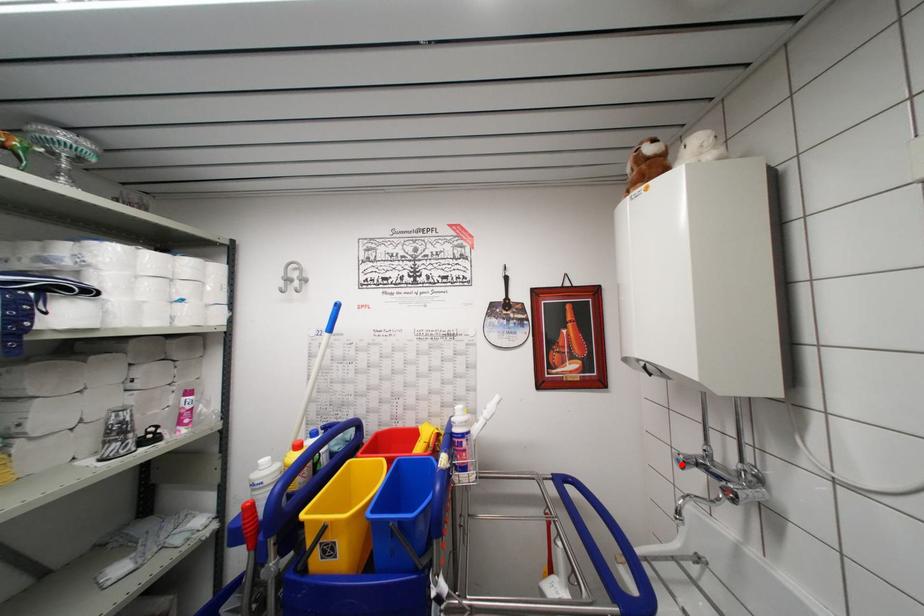
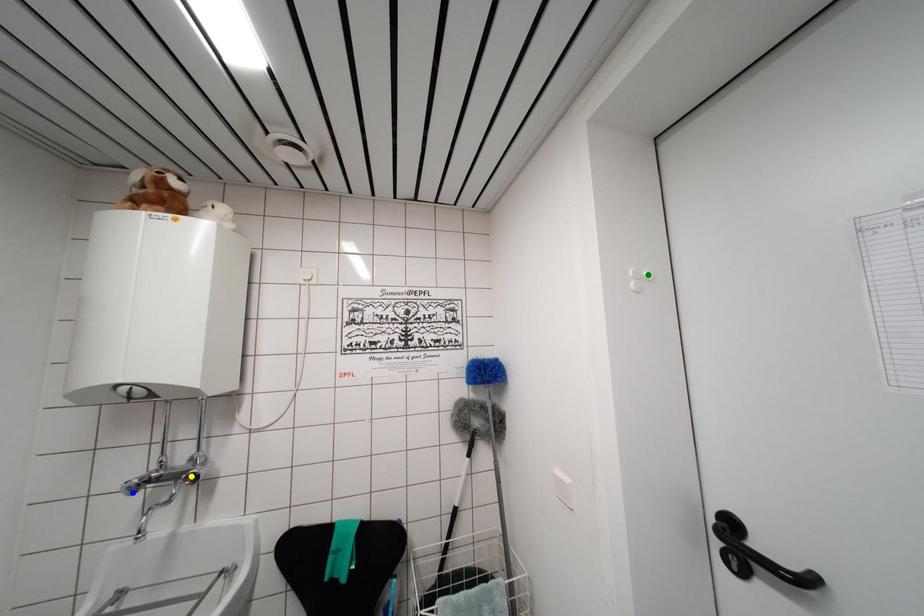
Question: I am providing you with two images of the same scene from different viewpoints. A red point is marked on the first image. You are given multiple points on the second image. Which mark in image 2 goes with the point in image 1?

Choices:
 (A) blue point
 (B) green point
 (C) yellow point

Answer: (A)